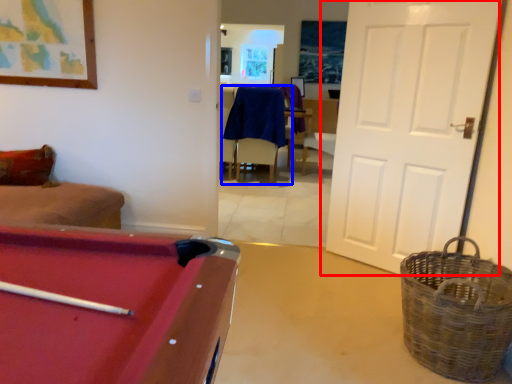
Question: Which object appears closest to the camera in this image, door (highlighted by a red box) or chair (highlighted by a blue box)?

Choices:
 (A) door
 (B) chair

Answer: (A)